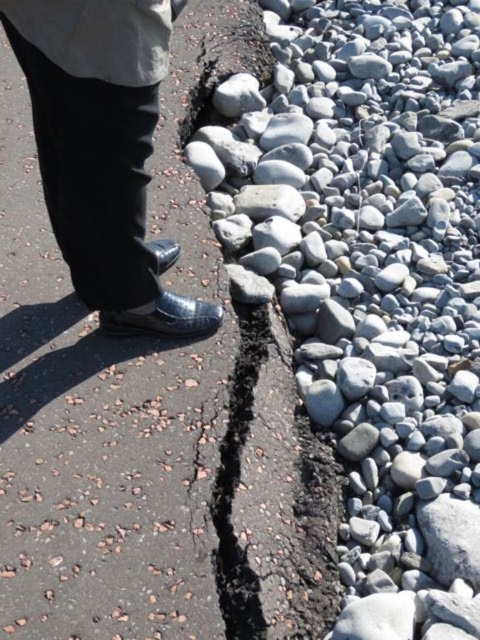
You are a construction worker assessing the site. You notice the gray smooth rocks at right and the black asphalt crack at center. Which object is higher in elevation?

The gray smooth rocks at right are taller than the black asphalt crack at center, meaning they are higher in elevation.

In the scene shown: You are a photographer trying to capture the shiny leather shoes at left and the white fabric trench coat at upper left in the same frame. Which object should you focus on first to ensure both are in sharp focus?

You should focus on the shiny leather shoes at left first because it is closer to you than the white fabric trench coat at upper left, ensuring both will be in focus when focused on the closer object.

Looking at this image, you are a construction worker inspecting the pavement. You notice the gray smooth rocks at right and the black asphalt crack at center. Which object is located above the other?

The gray smooth rocks at right is positioned over black asphalt crack at center.